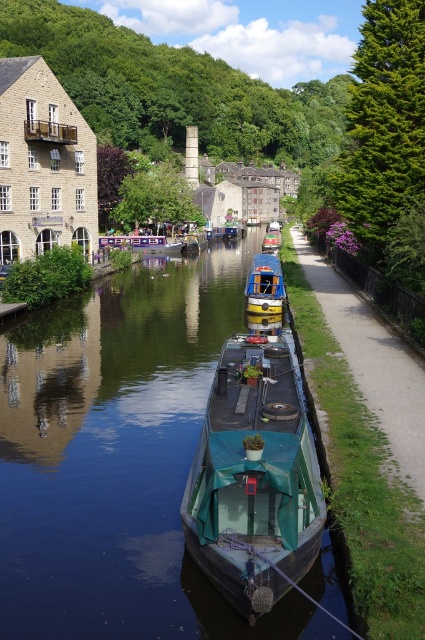
You are a GUI agent. You are given a task and a screenshot of the screen. Output one action in this format:
    pyautogui.click(x=<x>, y=<y>)
    Task: Click on the teal canvas boat at center
    
    Given the screenshot: What is the action you would take?
    pyautogui.click(x=255, y=477)

How distant is teal canvas boat at center from green canvas boat at center?

teal canvas boat at center and green canvas boat at center are 9.95 meters apart.

Is point (215, 563) farther from camera compared to point (418, 483)?

No, it is in front of (418, 483).

The height and width of the screenshot is (640, 425). What are the coordinates of `teal canvas boat at center` in the screenshot? It's located at (255, 477).

What do you see at coordinates (255, 477) in the screenshot? Image resolution: width=425 pixels, height=640 pixels. I see `teal canvas boat at center` at bounding box center [255, 477].

Is teal canvas boat at center below teal fabric boat at center?

Yes.

Between point (243, 616) and point (277, 268), which one is positioned in front?

Point (243, 616) is in front.

Locate an element on the screen. teal canvas boat at center is located at coordinates (255, 477).

Does green canvas boat at center come behind teal fabric boat at center?

No, green canvas boat at center is in front of teal fabric boat at center.

Is green canvas boat at center smaller than teal fabric boat at center?

Actually, green canvas boat at center might be larger than teal fabric boat at center.

At what (x,y) coordinates should I click in order to perform the action: click on green canvas boat at center. Please return your answer as a coordinate pair (x, y). Looking at the image, I should click on (374, 362).